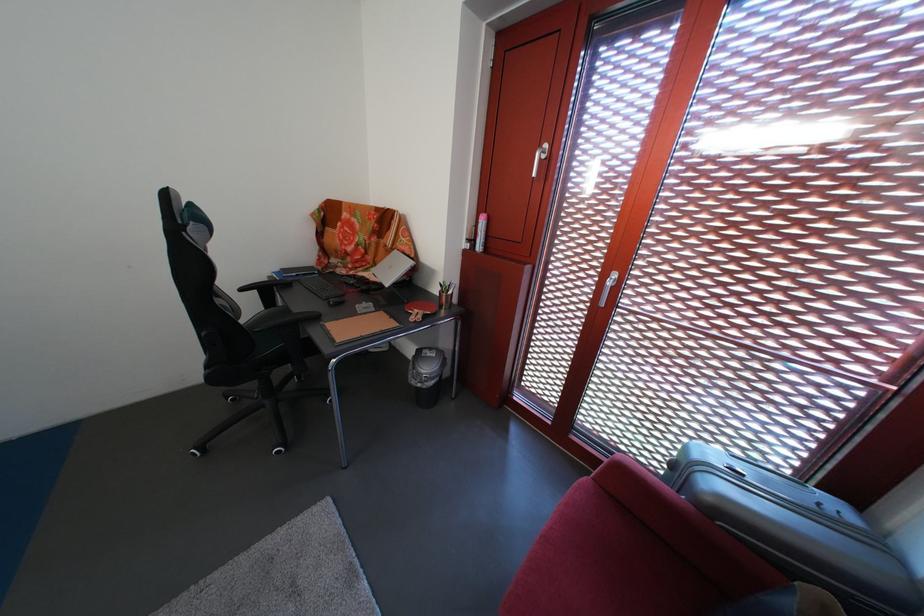
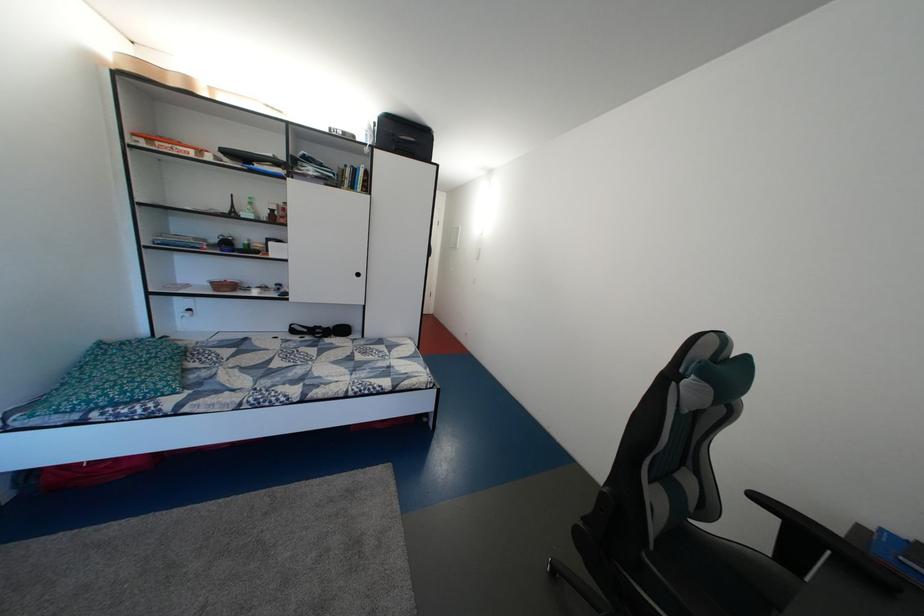
Question: How did the camera likely rotate?

Choices:
 (A) Left
 (B) Right
 (C) Up
 (D) Down

Answer: (A)